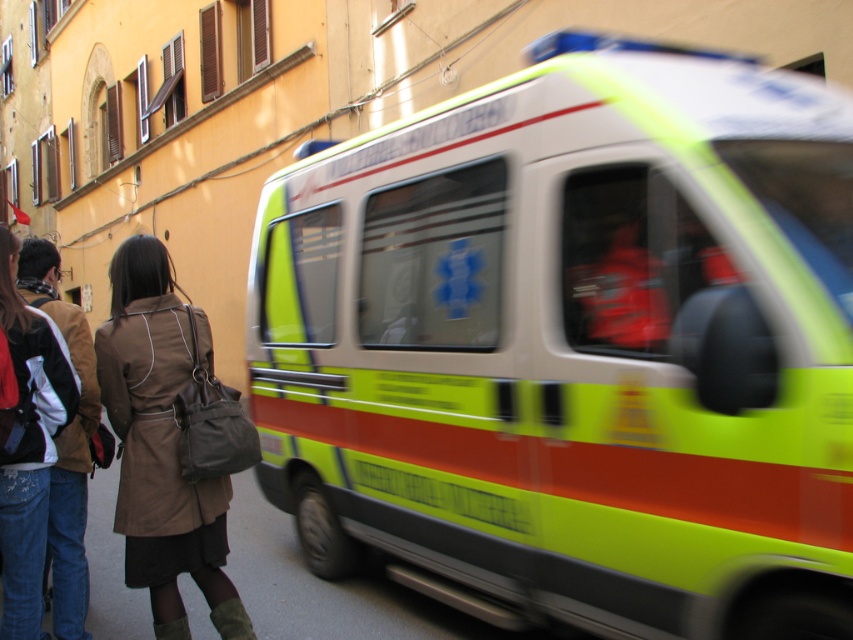
Can you confirm if neon yellow/reflective ambulance at center is thinner than brown leather coat at lower left?

No.

Can you confirm if neon yellow/reflective ambulance at center is taller than brown leather coat at lower left?

Indeed, neon yellow/reflective ambulance at center has a greater height compared to brown leather coat at lower left.

Is point (732, 292) positioned after point (144, 548)?

No.

This screenshot has width=853, height=640. I want to click on neon yellow/reflective ambulance at center, so click(573, 346).

Is brown leather coat at lower left wider than brown leather jacket at lower left?

Indeed, brown leather coat at lower left has a greater width compared to brown leather jacket at lower left.

Is brown leather coat at lower left above brown leather jacket at lower left?

No, brown leather coat at lower left is not above brown leather jacket at lower left.

The height and width of the screenshot is (640, 853). Find the location of `brown leather coat at lower left`. brown leather coat at lower left is located at coordinates (170, 440).

Does neon yellow/reflective ambulance at center have a greater height compared to brown leather jacket at lower left?

Yes, neon yellow/reflective ambulance at center is taller than brown leather jacket at lower left.

Who is positioned more to the right, neon yellow/reflective ambulance at center or brown leather jacket at lower left?

neon yellow/reflective ambulance at center is more to the right.

Find the location of a particular element. This screenshot has height=640, width=853. neon yellow/reflective ambulance at center is located at coordinates (573, 346).